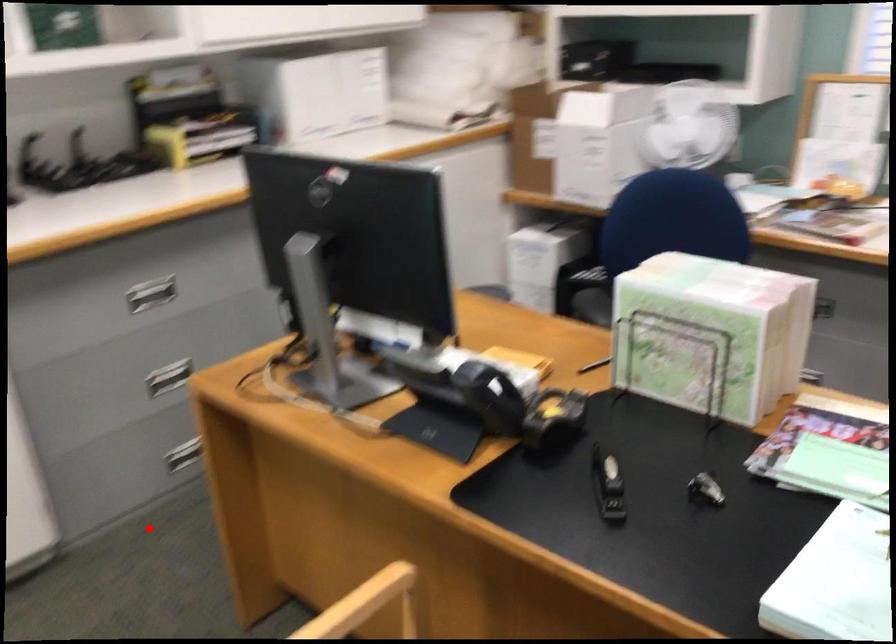
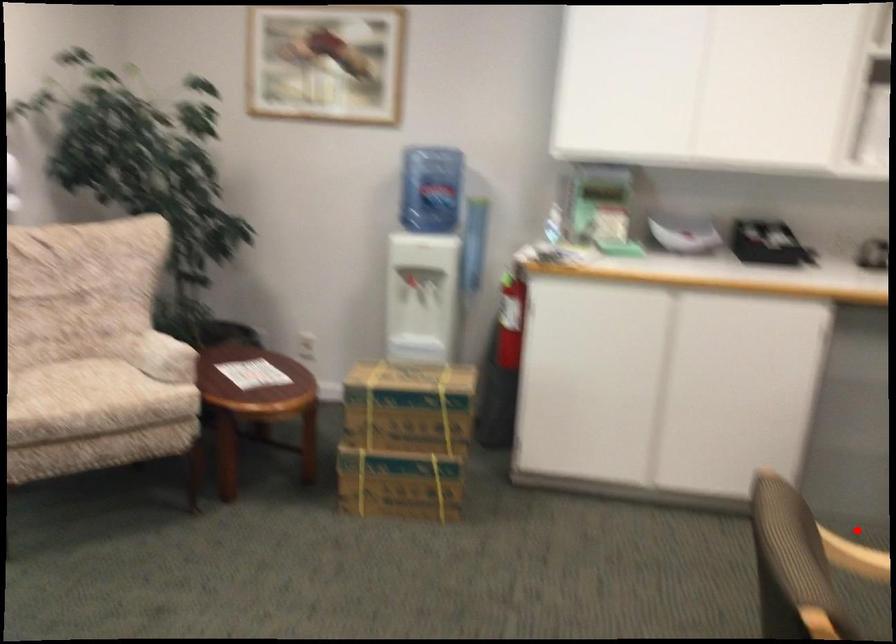
I am providing you with two images of the same scene from different viewpoints. A red point is marked on the first image and another point is marked on the second image. Do the highlighted points in image1 and image2 indicate the same real-world spot?

Yes